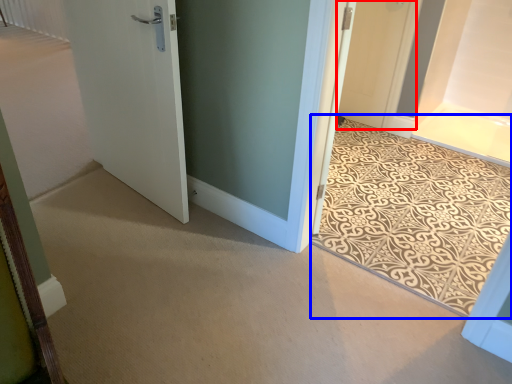
Question: Among these objects, which one is nearest to the camera, door (highlighted by a red box) or doormat (highlighted by a blue box)?

Choices:
 (A) door
 (B) doormat

Answer: (B)